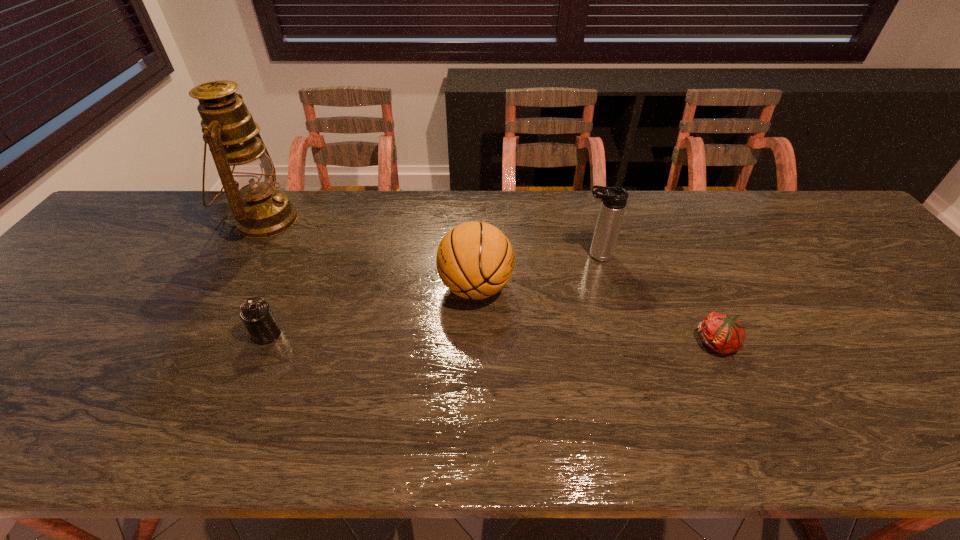
Identify the location of oil lamp. Image resolution: width=960 pixels, height=540 pixels. (247, 173).

This screenshot has width=960, height=540. I want to click on the leftmost object, so click(247, 173).

At what (x,y) coordinates should I click in order to perform the action: click on the fourth object from left to right. Please return your answer as a coordinate pair (x, y). Looking at the image, I should click on (614, 199).

Where is `basketball`? basketball is located at coordinates (475, 260).

Identify the location of the fourth object from right to left. (256, 314).

The height and width of the screenshot is (540, 960). I want to click on can, so click(x=256, y=314).

Where is `tomato`? This screenshot has height=540, width=960. tomato is located at coordinates (724, 334).

This screenshot has width=960, height=540. I want to click on the shortest object, so click(724, 334).

Where is `vacant space located on the right of the tallest object`? vacant space located on the right of the tallest object is located at coordinates (420, 220).

Find the location of a particular element. The height and width of the screenshot is (540, 960). vacant space located 0.190m on the handle side of the second object from right to left is located at coordinates (510, 255).